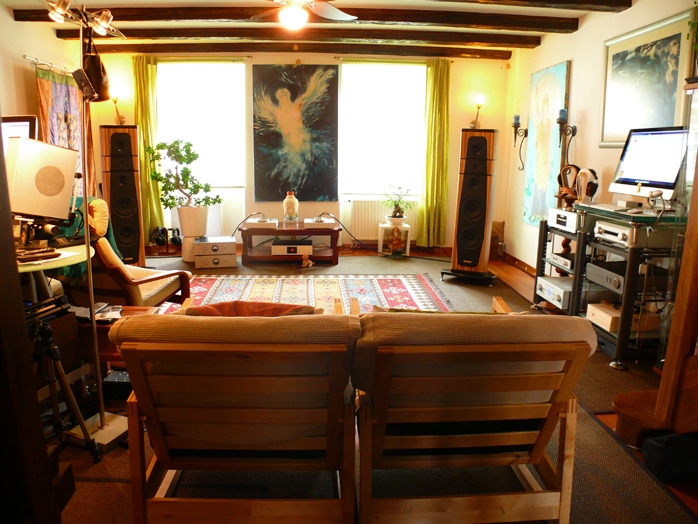
Locate an element on the screen. Image resolution: width=698 pixels, height=524 pixels. monitor is located at coordinates (20, 127).